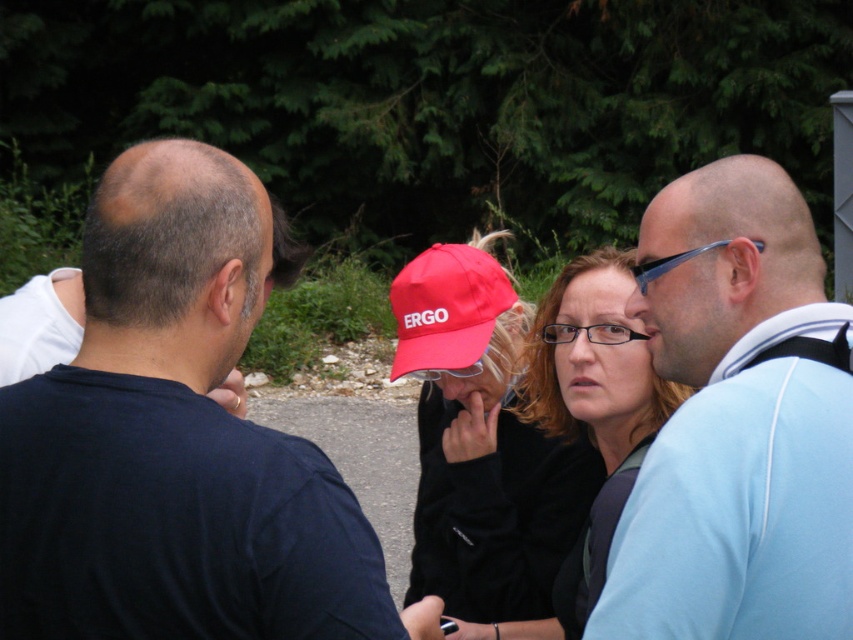
Is point (851, 516) positioned in front of point (624, 394)?

That is True.

Between point (697, 314) and point (645, 417), which one is positioned behind?

Positioned behind is point (645, 417).

The image size is (853, 640). Find the location of `light blue fabric shirt at right`. light blue fabric shirt at right is located at coordinates (735, 424).

I want to click on light blue fabric shirt at right, so click(x=735, y=424).

Who is positioned more to the left, light blue fabric shirt at right or matte red baseball cap at center?

Positioned to the left is matte red baseball cap at center.

Is light blue fabric shirt at right further to the viewer compared to matte red baseball cap at center?

No, light blue fabric shirt at right is in front of matte red baseball cap at center.

Is point (782, 477) positioned after point (405, 273)?

No.

You are a GUI agent. You are given a task and a screenshot of the screen. Output one action in this format:
    pyautogui.click(x=<x>, y=<y>)
    Task: Click on the light blue fabric shirt at right
    This screenshot has width=853, height=640.
    Given the screenshot: What is the action you would take?
    pyautogui.click(x=735, y=424)

Is dark blue t-shirt at left shorter than matte red baseball cap at center?

No, dark blue t-shirt at left is not shorter than matte red baseball cap at center.

Locate an element on the screen. This screenshot has width=853, height=640. dark blue t-shirt at left is located at coordinates (177, 442).

Find the location of `dark blue t-shirt at left`. dark blue t-shirt at left is located at coordinates (177, 442).